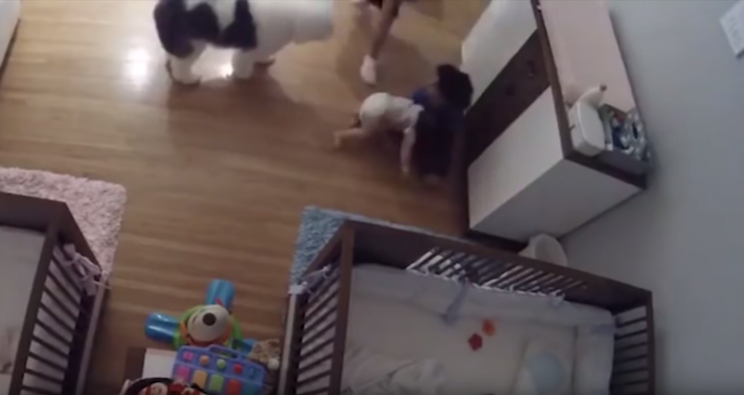
Locate an element on the screen. The image size is (744, 395). cribs is located at coordinates (32, 266), (341, 289).